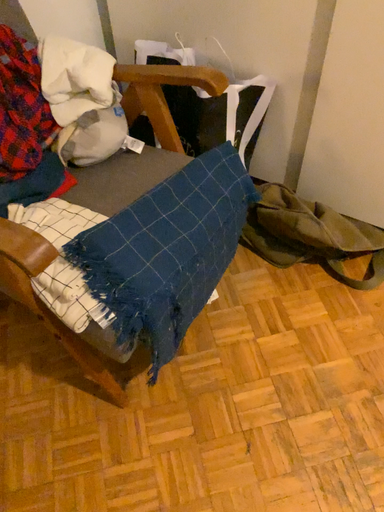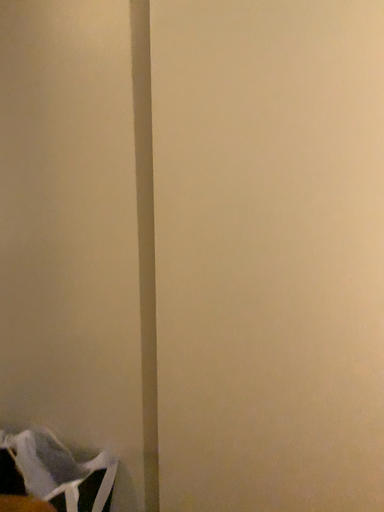
Question: Which way did the camera rotate in the video?

Choices:
 (A) rotated left
 (B) rotated right

Answer: (B)